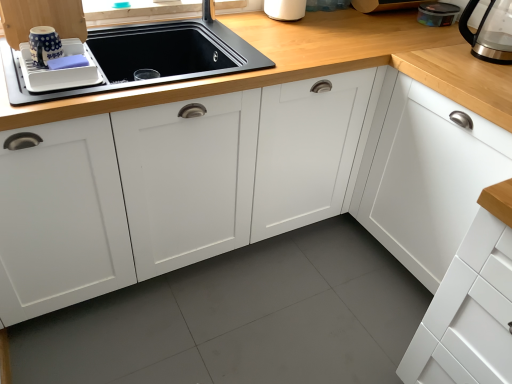
Find the location of a particular element. The height and width of the screenshot is (384, 512). vacant area that is in front of wooden cutting board at upper right, which is the 3th appliance in left-to-right order is located at coordinates (393, 21).